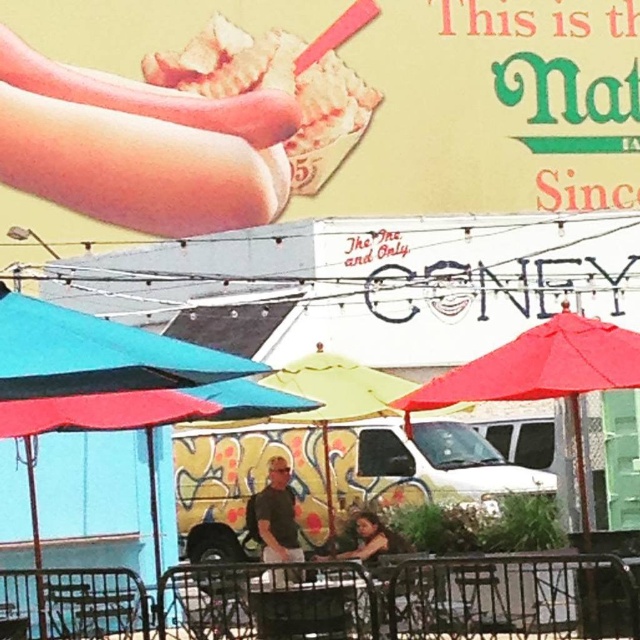
Does golden crispy waffle at upper center have a lesser width compared to dark gray shirt at center?

No, golden crispy waffle at upper center is not thinner than dark gray shirt at center.

Which is above, golden crispy waffle at upper center or dark gray shirt at center?

golden crispy waffle at upper center

Between point (252, 44) and point (294, 525), which one is positioned in front?

Point (294, 525) is in front.

Where is `golden crispy waffle at upper center`? The height and width of the screenshot is (640, 640). golden crispy waffle at upper center is located at coordinates (282, 84).

Does matte brown hot dog at upper left come behind dark gray shirt at center?

Yes.

Does matte brown hot dog at upper left appear on the right side of dark gray shirt at center?

In fact, matte brown hot dog at upper left is to the left of dark gray shirt at center.

Where is `matte brown hot dog at upper left`? Image resolution: width=640 pixels, height=640 pixels. matte brown hot dog at upper left is located at coordinates (140, 147).

Which of these two, matte brown hot dog at upper left or teal fabric umbrella at left, stands taller?

matte brown hot dog at upper left

Is point (120, 124) less distant than point (140, 424)?

No, (120, 124) is behind (140, 424).

Measure the distance between matte brown hot dog at upper left and camera.

A distance of 161.14 feet exists between matte brown hot dog at upper left and camera.

The width and height of the screenshot is (640, 640). Find the location of `matte brown hot dog at upper left`. matte brown hot dog at upper left is located at coordinates (140, 147).